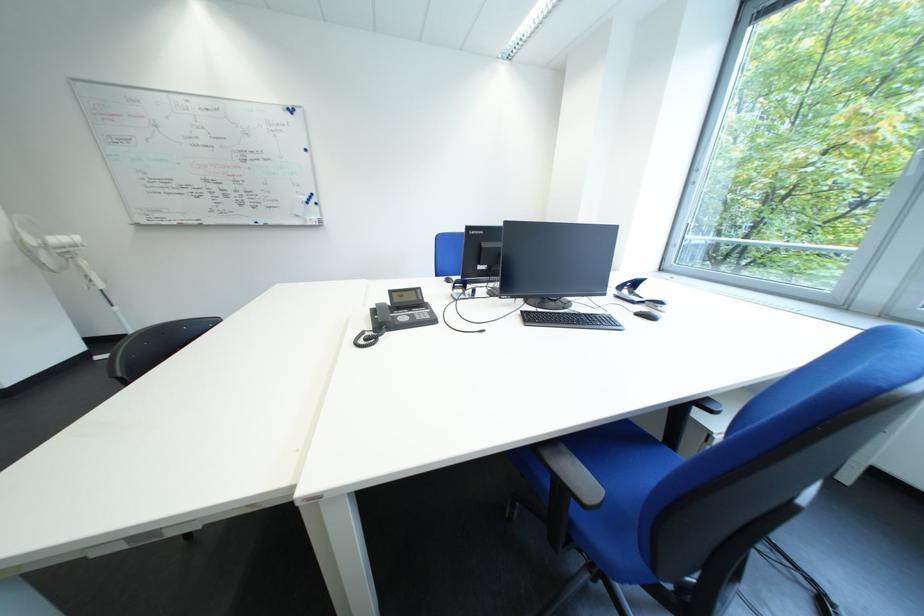
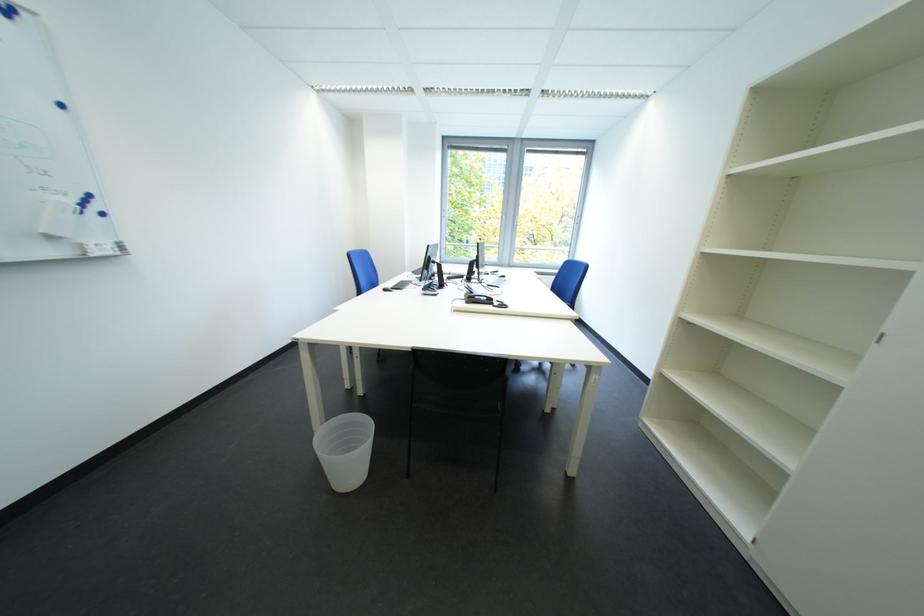
In the second image, find the point that corresponds to pixel 322 225 in the first image.

(108, 256)